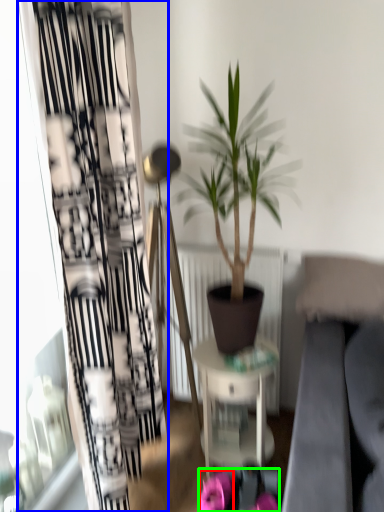
Question: Which object is the farthest from flower (highlighted by a red box)? Choose among these: curtain (highlighted by a blue box) or flower (highlighted by a green box).

Choices:
 (A) curtain
 (B) flower

Answer: (A)